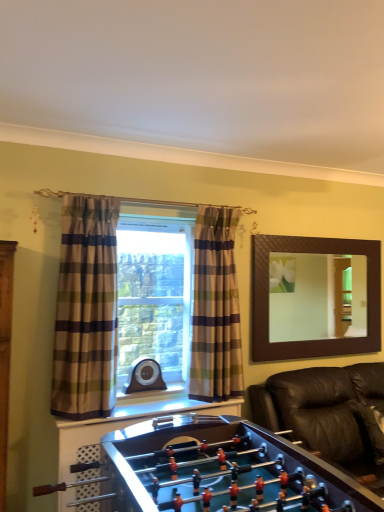
Question: Is plaid fabric curtain at center, the first curtain from the right, with brown textured mirror at upper right?

Choices:
 (A) no
 (B) yes

Answer: (A)

Question: From a real-world perspective, is plaid fabric curtain at center, the 1th curtain viewed from the back, located higher than brown textured mirror at upper right?

Choices:
 (A) no
 (B) yes

Answer: (A)

Question: Is plaid fabric curtain at center, positioned as the 2th curtain in front-to-back order, positioned behind brown textured mirror at upper right?

Choices:
 (A) no
 (B) yes

Answer: (A)

Question: Is plaid fabric curtain at center, positioned as the 2th curtain in front-to-back order, looking in the opposite direction of brown textured mirror at upper right?

Choices:
 (A) no
 (B) yes

Answer: (A)

Question: Is plaid fabric curtain at center, the 1th curtain viewed from the back, closer to camera compared to brown textured mirror at upper right?

Choices:
 (A) yes
 (B) no

Answer: (A)

Question: From the image's perspective, is shiny brown foosball table at lower center positioned above or below black leather couch at lower right?

Choices:
 (A) above
 (B) below

Answer: (A)

Question: Is shiny brown foosball table at lower center wider or thinner than black leather couch at lower right?

Choices:
 (A) thin
 (B) wide

Answer: (B)

Question: From a real-world perspective, is shiny brown foosball table at lower center above or below black leather couch at lower right?

Choices:
 (A) below
 (B) above

Answer: (B)

Question: Based on their sizes in the image, would you say shiny brown foosball table at lower center is bigger or smaller than black leather couch at lower right?

Choices:
 (A) big
 (B) small

Answer: (B)

Question: From a real-world perspective, is shiny brown foosball table at lower center above or below plaid fabric curtain at center, which ranks as the 2th curtain in left-to-right order?

Choices:
 (A) above
 (B) below

Answer: (B)

Question: Is shiny brown foosball table at lower center situated inside plaid fabric curtain at center, positioned as the 2th curtain in front-to-back order, or outside?

Choices:
 (A) outside
 (B) inside

Answer: (A)

Question: Relative to plaid fabric curtain at center, the 1th curtain viewed from the back, is shiny brown foosball table at lower center in front or behind?

Choices:
 (A) behind
 (B) front

Answer: (B)

Question: Considering the relative positions of shiny brown foosball table at lower center and plaid fabric curtain at center, the 1th curtain viewed from the back, in the image provided, is shiny brown foosball table at lower center to the left or to the right of plaid fabric curtain at center, the 1th curtain viewed from the back,?

Choices:
 (A) right
 (B) left

Answer: (B)

Question: From a real-world perspective, is brown textured mirror at upper right above or below plaid fabric curtain at center, the 1th curtain viewed from the back?

Choices:
 (A) above
 (B) below

Answer: (A)

Question: Visually, is brown textured mirror at upper right positioned to the left or to the right of plaid fabric curtain at center, the 1th curtain viewed from the back?

Choices:
 (A) left
 (B) right

Answer: (B)